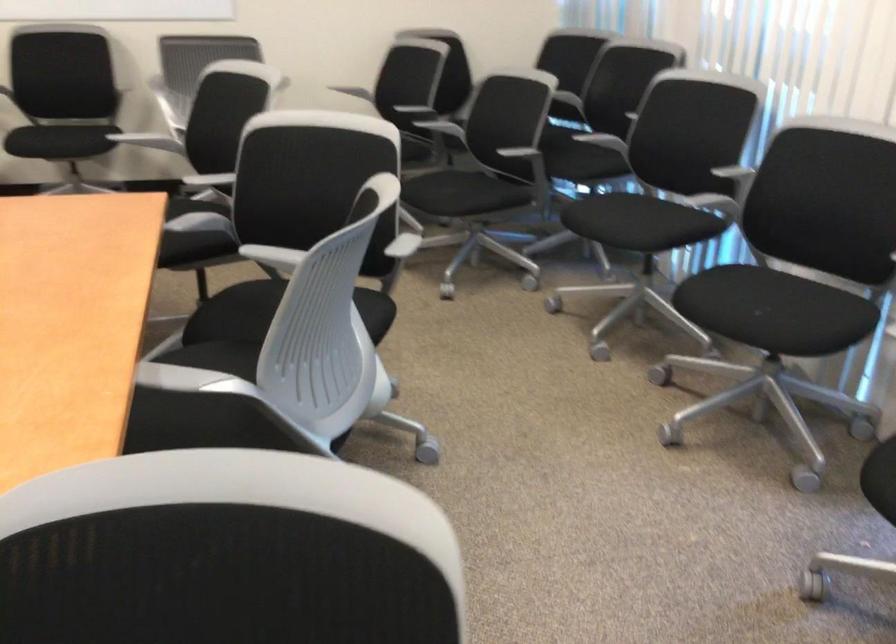
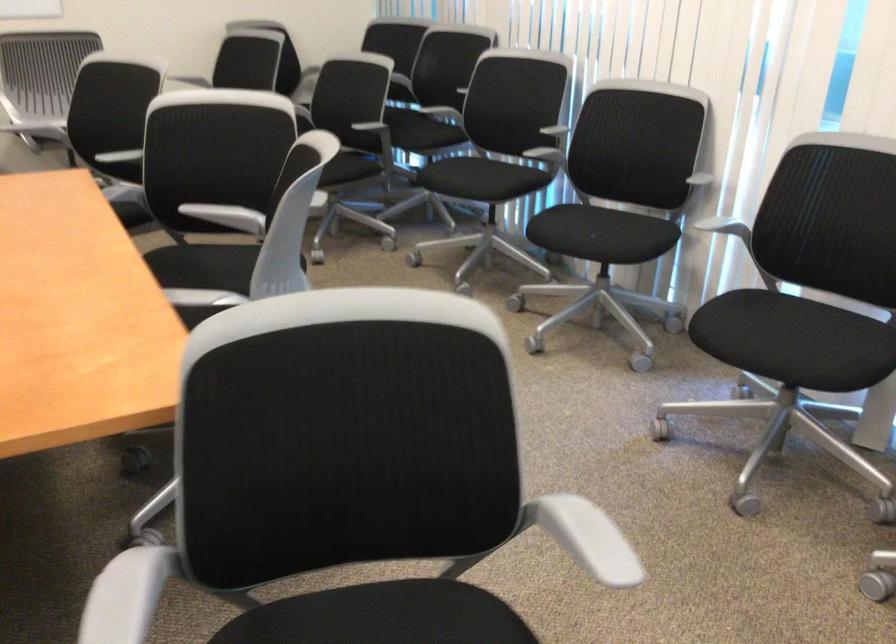
The point at (263, 259) is marked in the first image. Where is the corresponding point in the second image?

(208, 212)